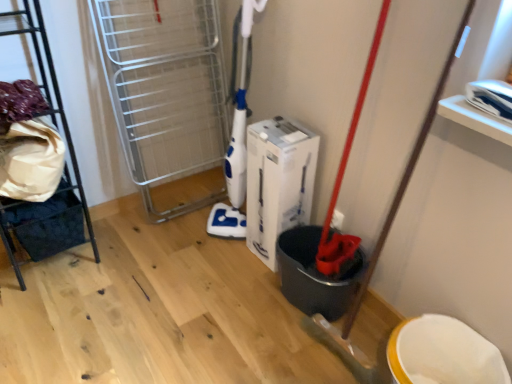
The height and width of the screenshot is (384, 512). Find the location of `vacant space in front of metallic black rack at left`. vacant space in front of metallic black rack at left is located at coordinates (45, 312).